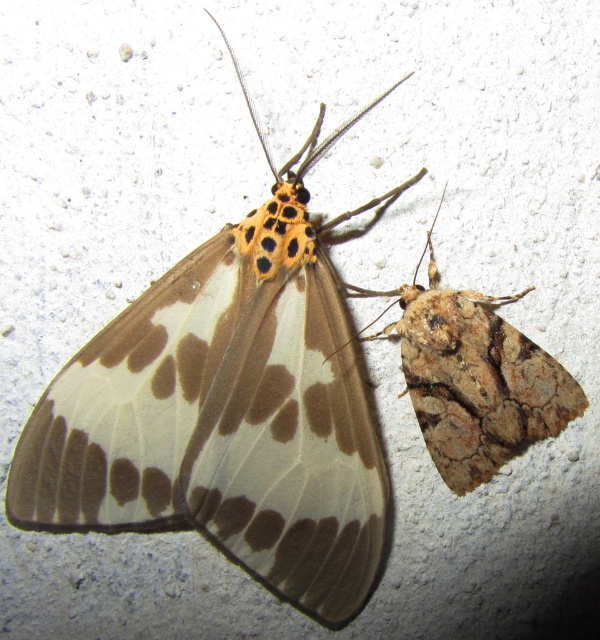
Question: Can you confirm if translucent brown moth at upper left is positioned to the right of brown textured moth at right?

Choices:
 (A) no
 (B) yes

Answer: (A)

Question: Among these objects, which one is nearest to the camera?

Choices:
 (A) translucent brown moth at upper left
 (B) brown textured moth at right

Answer: (A)

Question: Can you confirm if translucent brown moth at upper left is thinner than brown textured moth at right?

Choices:
 (A) yes
 (B) no

Answer: (B)

Question: Which object appears farthest from the camera in this image?

Choices:
 (A) translucent brown moth at upper left
 (B) brown textured moth at right

Answer: (B)

Question: Among these points, which one is nearest to the camera?

Choices:
 (A) (475, 403)
 (B) (358, 445)

Answer: (B)

Question: Is translucent brown moth at upper left positioned in front of brown textured moth at right?

Choices:
 (A) yes
 (B) no

Answer: (A)